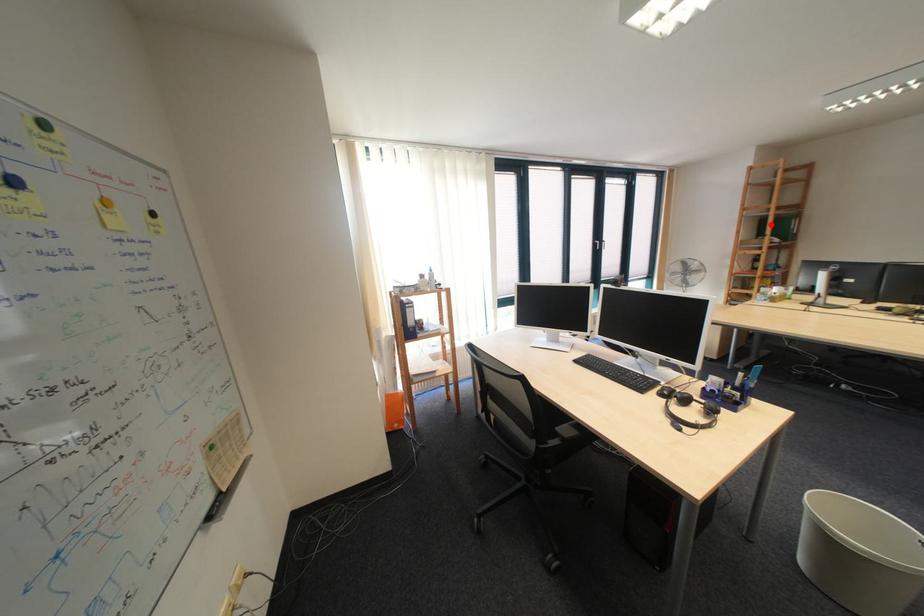
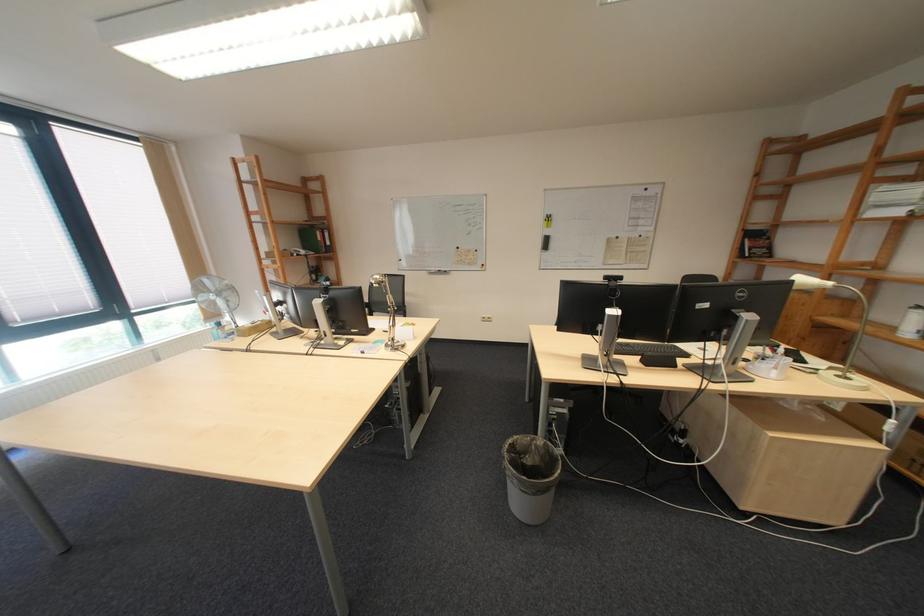
In the second image, find the point that corresponds to the highlighted location in the first image.

(310, 233)